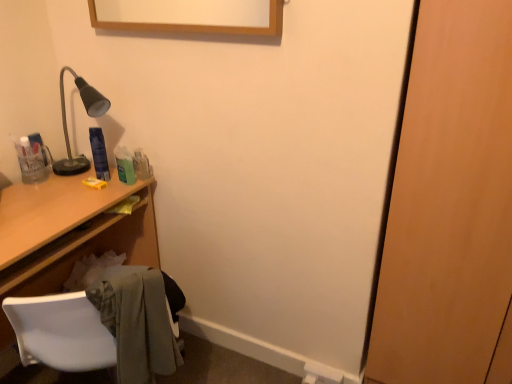
Image resolution: width=512 pixels, height=384 pixels. In order to click on wooden door at right in this screenshot , I will do `click(450, 206)`.

At what (x,y) coordinates should I click in order to perform the action: click on light gray fabric at lower left. Please return your answer as a coordinate pair (x, y). This screenshot has height=384, width=512. Looking at the image, I should click on (139, 321).

The height and width of the screenshot is (384, 512). I want to click on blue plastic can at upper left, so click(99, 153).

Is white plastic chair at lower left outside of wooden desk at left?

Yes, white plastic chair at lower left is located beyond the bounds of wooden desk at left.

Does white plastic chair at lower left appear on the right side of wooden desk at left?

Correct, you'll find white plastic chair at lower left to the right of wooden desk at left.

From a real-world perspective, is white plastic chair at lower left located higher than wooden desk at left?

Yes, from a real-world perspective, white plastic chair at lower left is over wooden desk at left

Would you say white plastic chair at lower left is a long distance from wooden desk at left?

That's not correct — white plastic chair at lower left is a little close to wooden desk at left.

From a real-world perspective, between blue plastic can at upper left and wooden desk at left, who is vertically higher?

blue plastic can at upper left.

I want to click on toiletry on the right of wooden desk at left, so click(x=99, y=153).

Considering the points (101, 153) and (19, 273), which point is in front, point (101, 153) or point (19, 273)?

The point (19, 273) is closer.

Is blue plastic can at upper left to the left of wooden desk at left from the viewer's perspective?

Incorrect, blue plastic can at upper left is not on the left side of wooden desk at left.

Find the location of a particular element. desk behind the wooden door at right is located at coordinates (68, 233).

Which is more to the left, wooden desk at left or wooden door at right?

wooden desk at left is more to the left.

Measure the distance between wooden desk at left and wooden door at right.

wooden desk at left is 1.10 meters away from wooden door at right.

Is wooden desk at left not inside wooden door at right?

wooden desk at left lies outside wooden door at right's area.

How many degrees apart are the facing directions of wooden door at right and light gray fabric at lower left?

The angular difference between wooden door at right and light gray fabric at lower left is 131 degrees.

Are wooden door at right and light gray fabric at lower left located far from each other?

Actually, wooden door at right and light gray fabric at lower left are a little close together.

Identify the location of clothe on the left of the wooden door at right. (139, 321).

Is wooden door at right inside or outside of light gray fabric at lower left?

wooden door at right is outside light gray fabric at lower left.

Is white plastic chair at lower left completely or partially inside wooden door at right?

That's incorrect, white plastic chair at lower left is not inside wooden door at right.

Based on the photo, is wooden door at right oriented away from white plastic chair at lower left?

That's not correct — wooden door at right is not looking away from white plastic chair at lower left.

From a real-world perspective, which object rests below the other?

In real-world perspective, white plastic chair at lower left is lower.

Does wooden door at right appear on the left side of white plastic chair at lower left?

No.

Can you confirm if blue plastic can at upper left is bigger than wooden door at right?

Actually, blue plastic can at upper left might be smaller than wooden door at right.

From the image's perspective, would you say blue plastic can at upper left is shown under wooden door at right?

Actually, blue plastic can at upper left appears above wooden door at right in the image.

Based on the photo, which is correct: blue plastic can at upper left is inside wooden door at right, or outside of it?

blue plastic can at upper left is not enclosed by wooden door at right.

Does light gray fabric at lower left have a lesser height compared to wooden door at right?

Yes.

What's the angular difference between light gray fabric at lower left and wooden door at right's facing directions?

The facing directions of light gray fabric at lower left and wooden door at right are 131 degrees apart.

Consider the image. From a real-world perspective, who is located lower, light gray fabric at lower left or wooden door at right?

From a 3D spatial view, light gray fabric at lower left is below.

Are light gray fabric at lower left and wooden door at right beside each other?

No, light gray fabric at lower left is not touching wooden door at right.

Where is `computer chair that appears below the wooden desk at left (from the image's perspective)`? The image size is (512, 384). computer chair that appears below the wooden desk at left (from the image's perspective) is located at coordinates (61, 332).

What are the coordinates of `desk that appears in front of the blue plastic can at upper left` in the screenshot? It's located at (68, 233).

Based on their spatial positions, is light gray fabric at lower left or wooden desk at left further from white plastic chair at lower left?

wooden desk at left is positioned further to the anchor white plastic chair at lower left.

Looking at the image, which one is located closer to blue plastic can at upper left, white plastic chair at lower left or light gray fabric at lower left?

Based on the image, white plastic chair at lower left appears to be nearer to blue plastic can at upper left.

Considering their positions, is white plastic chair at lower left positioned further to wooden door at right than blue plastic can at upper left?

The object further to wooden door at right is blue plastic can at upper left.

When comparing their distances from blue plastic can at upper left, does wooden desk at left or wooden door at right seem further?

wooden door at right is further to blue plastic can at upper left.

In the scene shown: Estimate the real-world distances between objects in this image. Which object is closer to wooden door at right, wooden desk at left or white plastic chair at lower left?

Among the two, white plastic chair at lower left is located nearer to wooden door at right.

Based on their spatial positions, is blue plastic can at upper left or white plastic chair at lower left closer to wooden door at right?

white plastic chair at lower left.

Based on their spatial positions, is light gray fabric at lower left or blue plastic can at upper left further from white plastic chair at lower left?

blue plastic can at upper left lies further to white plastic chair at lower left than the other object.

Based on the photo, from the image, which object appears to be farther from wooden desk at left, wooden door at right or blue plastic can at upper left?

wooden door at right lies further to wooden desk at left than the other object.

I want to click on desk between blue plastic can at upper left and white plastic chair at lower left vertically, so click(x=68, y=233).

This screenshot has width=512, height=384. Identify the location of toiletry between white plastic chair at lower left and wooden door at right in the horizontal direction. (99, 153).

I want to click on computer chair located between wooden desk at left and wooden door at right in the left-right direction, so click(x=61, y=332).

What are the coordinates of `desk between blue plastic can at upper left and light gray fabric at lower left from top to bottom` in the screenshot? It's located at (68, 233).